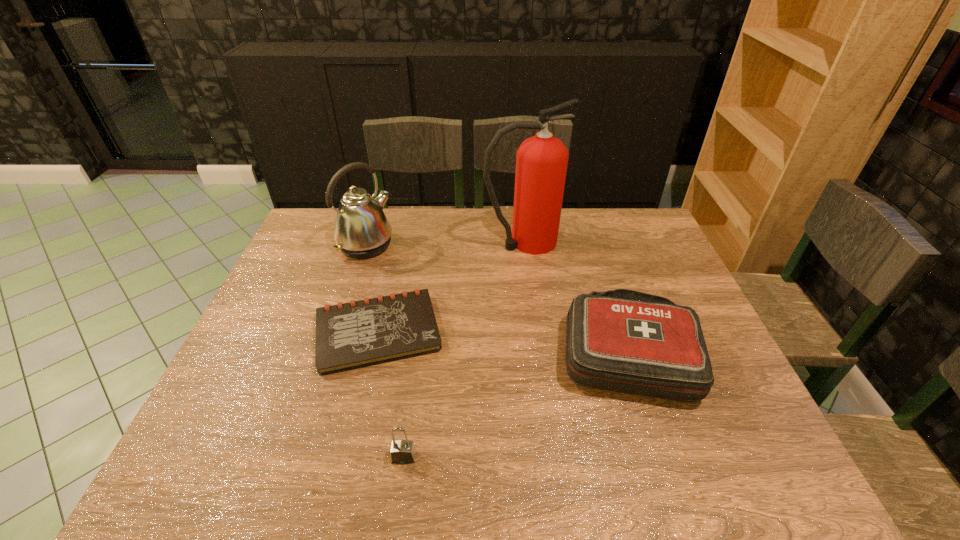
I want to click on unoccupied area between the second tallest object and the shortest object, so click(372, 289).

Select which object is the third closest to the kettle. Please provide its 2D coordinates. Your answer should be formatted as a tuple, i.e. [(x, y)], where the tuple contains the x and y coordinates of a point satisfying the conditions above.

[(621, 340)]

The image size is (960, 540). Find the location of `the second closest object relative to the notebook`. the second closest object relative to the notebook is located at coordinates (402, 452).

This screenshot has height=540, width=960. Identify the location of free region that satisfies the following two spatial constraints: 1. on the handle side of the tallest object; 2. on the shackle of the nearest object. (549, 457).

This screenshot has width=960, height=540. I want to click on blank area in the image that satisfies the following two spatial constraints: 1. on the handle side of the tallest object; 2. on the left side of the first-aid kit, so click(536, 352).

This screenshot has width=960, height=540. Find the location of `free space in the image that satisfies the following two spatial constraints: 1. on the back side of the first-aid kit; 2. on the handle side of the tallest object`. free space in the image that satisfies the following two spatial constraints: 1. on the back side of the first-aid kit; 2. on the handle side of the tallest object is located at coordinates (595, 242).

You are a GUI agent. You are given a task and a screenshot of the screen. Output one action in this format:
    pyautogui.click(x=<x>, y=<y>)
    Task: Click on the free spot that satisfies the following two spatial constraints: 1. on the handle side of the fire extinguisher; 2. on the shackle of the padlock
    Image resolution: width=960 pixels, height=540 pixels.
    Given the screenshot: What is the action you would take?
    pyautogui.click(x=549, y=457)

Identify the location of free space that satisfies the following two spatial constraints: 1. on the handle side of the tallest object; 2. on the shackle of the padlock. (549, 457).

The width and height of the screenshot is (960, 540). I want to click on vacant region that satisfies the following two spatial constraints: 1. on the handle side of the tallest object; 2. on the shackle of the padlock, so click(549, 457).